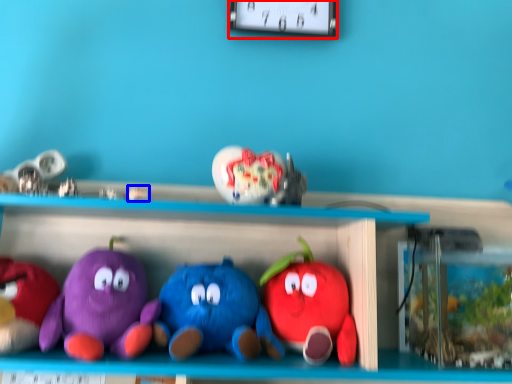
Question: Which point is further to the camera, clock (highlighted by a red box) or toy (highlighted by a blue box)?

Choices:
 (A) clock
 (B) toy

Answer: (A)